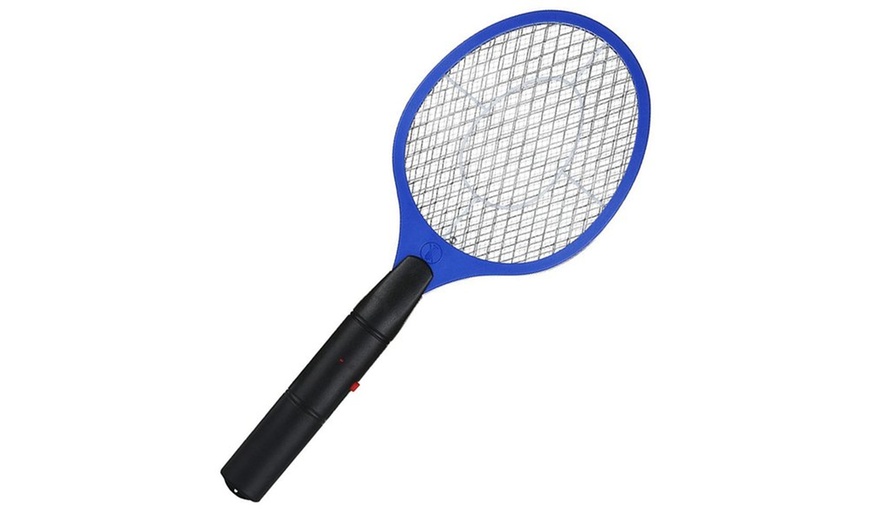
Locate an element on the screen. electric mosquito zapper racket is located at coordinates (526, 16).